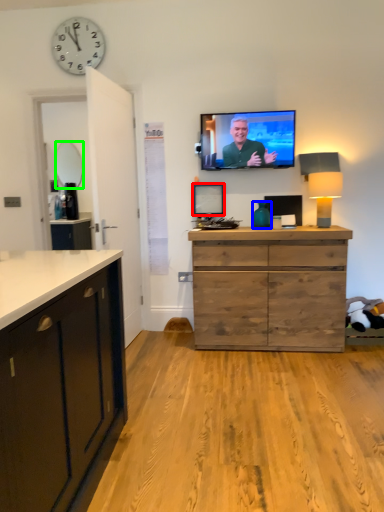
Question: Which object is positioned farthest from picture frame (highlighted by a red box)? Select from vase (highlighted by a blue box) and mirror (highlighted by a green box).

Choices:
 (A) vase
 (B) mirror

Answer: (B)